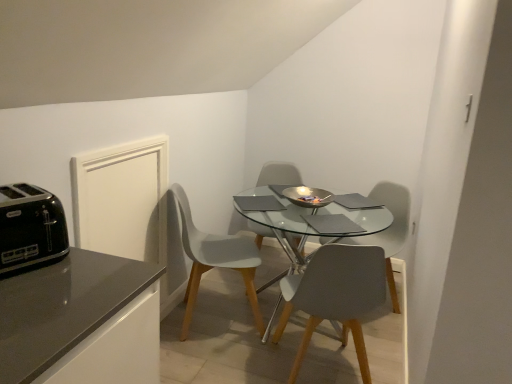
Where is `vacant space that is in between matte gray chair at center, the 2th chair when ordered from right to left, and transparent glass table at center`? The width and height of the screenshot is (512, 384). vacant space that is in between matte gray chair at center, the 2th chair when ordered from right to left, and transparent glass table at center is located at coordinates (249, 366).